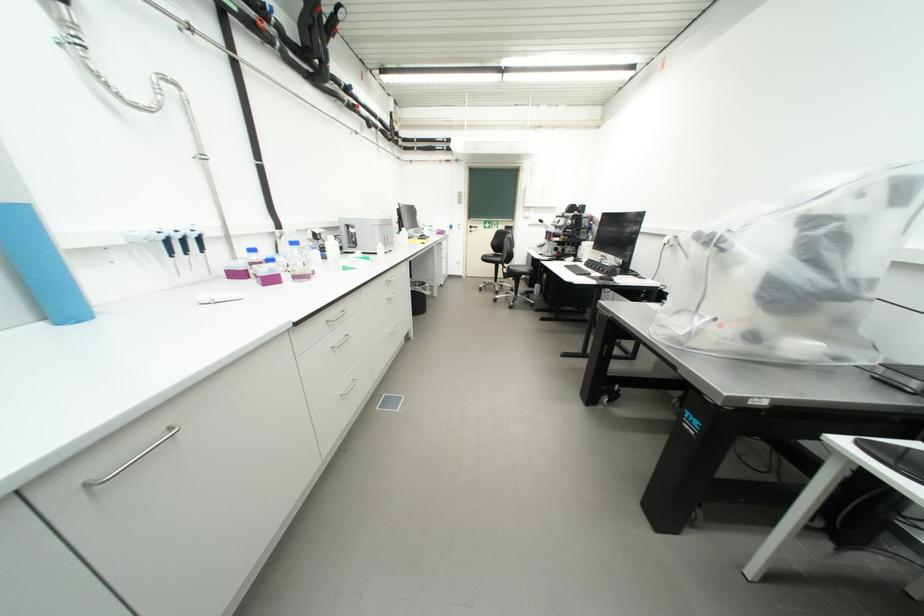
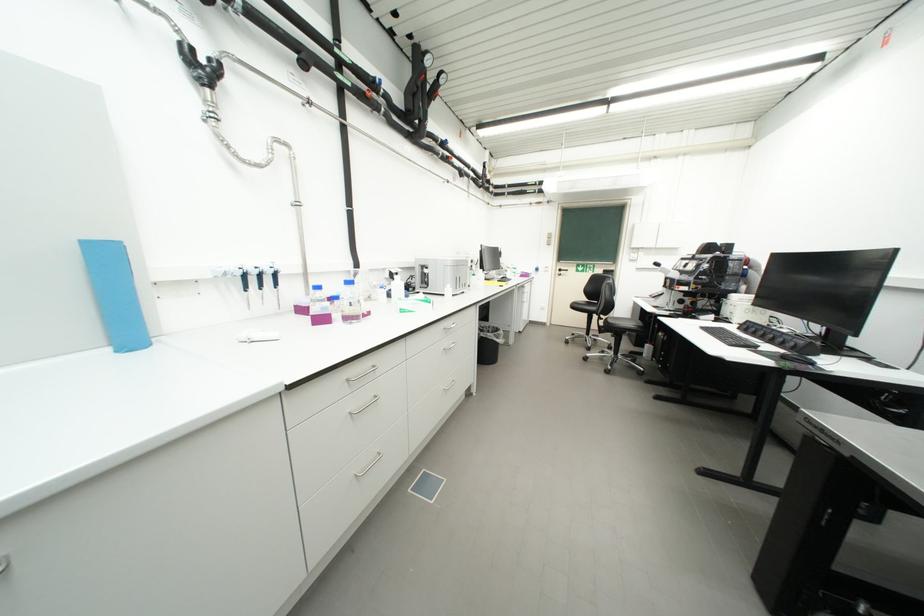
Locate, in the second image, the point that corresponds to pixel 280 282 in the first image.

(330, 321)